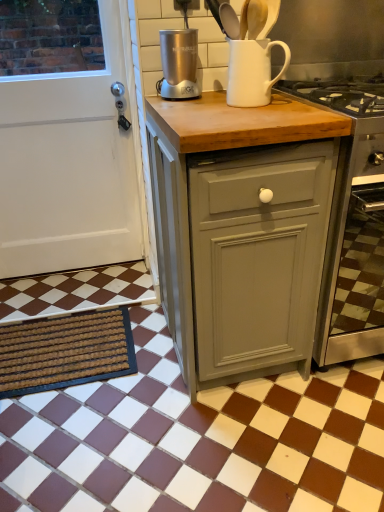
You are a GUI agent. You are given a task and a screenshot of the screen. Output one action in this format:
    pyautogui.click(x=<x>, y=<y>)
    Task: Click on the vacant region above brown/white checkered tile at lower center (from a real-world perspective)
    The width and height of the screenshot is (384, 512).
    Given the screenshot: What is the action you would take?
    pyautogui.click(x=182, y=420)